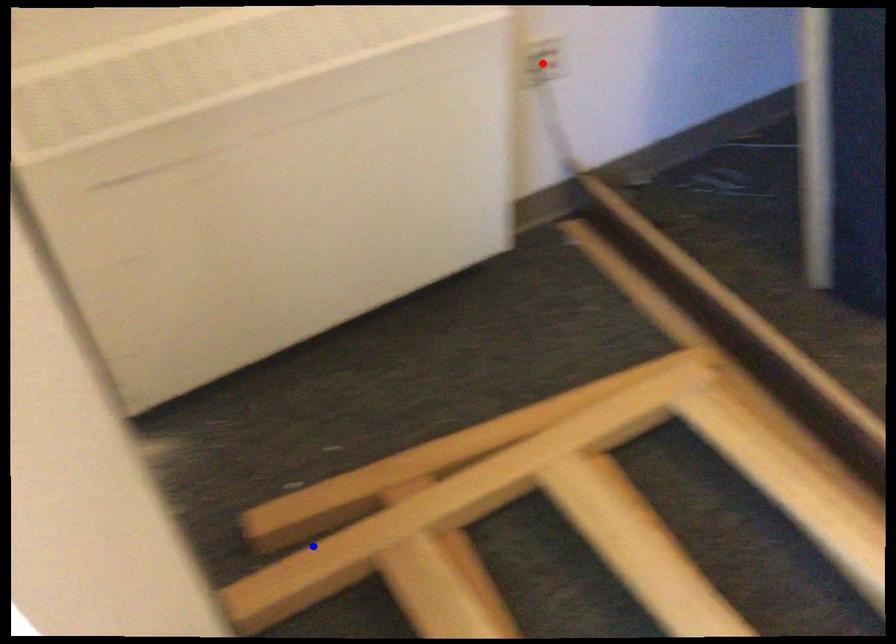
Question: Which of the two points in the image is closer to the camera?

Choices:
 (A) Blue point is closer.
 (B) Red point is closer.

Answer: (A)